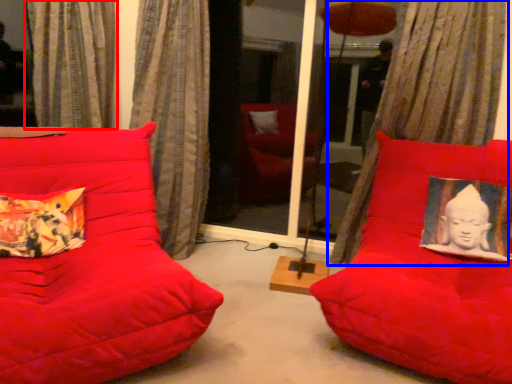
Question: Among these objects, which one is farthest to the camera, curtain (highlighted by a red box) or curtain (highlighted by a blue box)?

Choices:
 (A) curtain
 (B) curtain

Answer: (A)